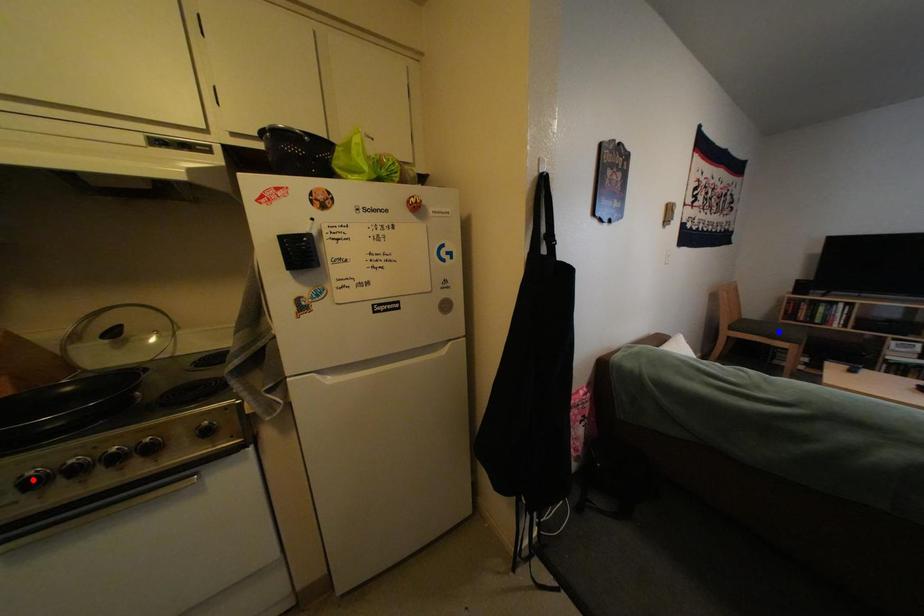
Question: In the image, two points are highlighted. Which point is nearer to the camera? Reply with the corresponding letter.

Choices:
 (A) blue point
 (B) red point

Answer: (B)